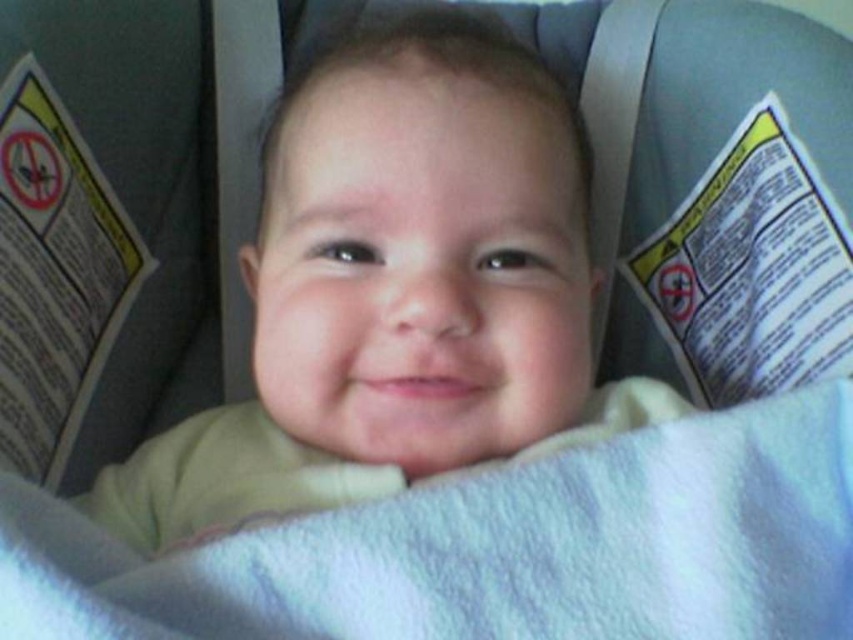
From the picture: Which of these two, smooth yellow shirt at center or white soft blanket at center, stands shorter?

white soft blanket at center

At what (x,y) coordinates should I click in order to perform the action: click on smooth yellow shirt at center. Please return your answer as a coordinate pair (x, y). Looking at the image, I should click on (397, 292).

Where is `smooth yellow shirt at center`? The width and height of the screenshot is (853, 640). smooth yellow shirt at center is located at coordinates (397, 292).